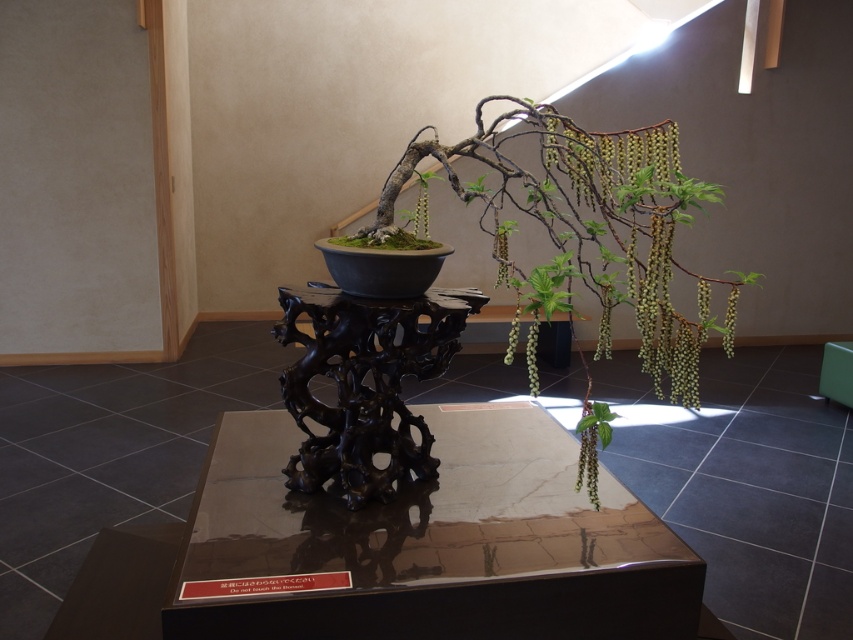
Question: Can you confirm if glossy dark wood table at center is bigger than green matte plant at center?

Choices:
 (A) yes
 (B) no

Answer: (A)

Question: Which point is farther to the camera?

Choices:
 (A) (508, 502)
 (B) (421, 220)

Answer: (B)

Question: Which of the following is the closest to the observer?

Choices:
 (A) (685, 333)
 (B) (427, 237)

Answer: (A)

Question: Which object is closer to the camera taking this photo?

Choices:
 (A) glossy dark wood table at center
 (B) green matte plant at center

Answer: (A)

Question: Is glossy dark wood table at center closer to the viewer compared to green matte plant at center?

Choices:
 (A) no
 (B) yes

Answer: (B)

Question: Is glossy dark wood table at center below green matte bonsai tree at center?

Choices:
 (A) yes
 (B) no

Answer: (A)